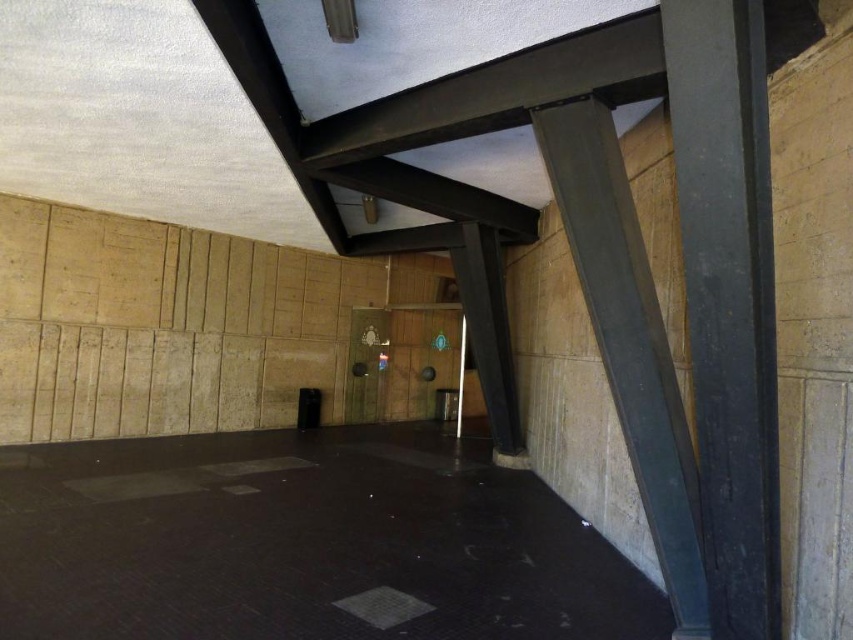
Question: Can you confirm if black concrete floor at lower left is thinner than smooth gray steel beam at right?

Choices:
 (A) no
 (B) yes

Answer: (A)

Question: Is smooth gray steel beam at right further to camera compared to metallic gray beam at center?

Choices:
 (A) no
 (B) yes

Answer: (A)

Question: Which object is closer to the camera taking this photo?

Choices:
 (A) smooth gray steel beam at right
 (B) metallic gray beam at center

Answer: (A)

Question: Among these points, which one is farthest from the camera?

Choices:
 (A) (718, 291)
 (B) (666, 456)
 (C) (447, 621)

Answer: (C)

Question: Considering the relative positions of smooth gray steel beam at right and metallic gray beam at center in the image provided, where is smooth gray steel beam at right located with respect to metallic gray beam at center?

Choices:
 (A) left
 (B) right

Answer: (B)

Question: Which point is closer to the camera?

Choices:
 (A) black concrete floor at lower left
 (B) metallic gray beam at center

Answer: (B)